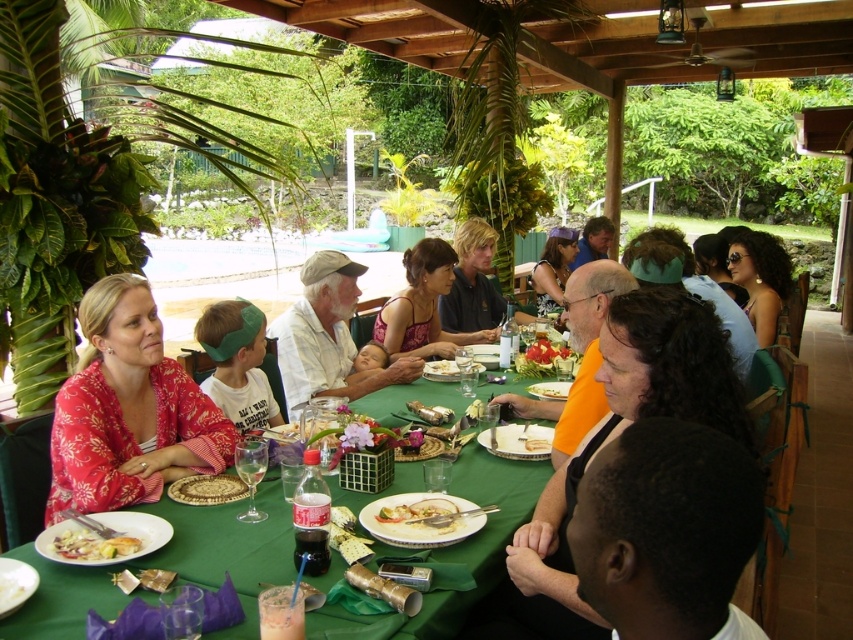
Who is taller, green fabric headband at center or white porcelain plate at center?

green fabric headband at center is taller.

This screenshot has width=853, height=640. In order to click on green fabric headband at center in this screenshot , I will do `click(236, 364)`.

Does blue fabric shirt at upper center have a larger size compared to white matte plate at lower left?

Indeed, blue fabric shirt at upper center has a larger size compared to white matte plate at lower left.

In the scene shown: Measure the distance between point (593, 234) and camera.

Point (593, 234) and camera are 6.49 meters apart.

Where is `blue fabric shirt at upper center`? This screenshot has width=853, height=640. blue fabric shirt at upper center is located at coordinates (593, 241).

Where is `blue fabric shirt at upper center`? This screenshot has width=853, height=640. blue fabric shirt at upper center is located at coordinates (593, 241).

Does green fabric table at center appear on the right side of dark brown curly hair at center?

No, green fabric table at center is not to the right of dark brown curly hair at center.

Is point (436, 609) behind point (639, 385)?

No, it is not.

The image size is (853, 640). Identify the location of green fabric table at center. [x=167, y=566].